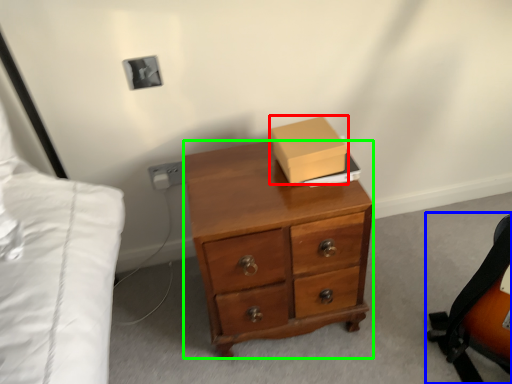
Question: Estimate the real-world distances between objects in this image. Which object is closer to box (highlighted by a red box), messenger bag (highlighted by a blue box) or desk (highlighted by a green box)?

Choices:
 (A) messenger bag
 (B) desk

Answer: (B)